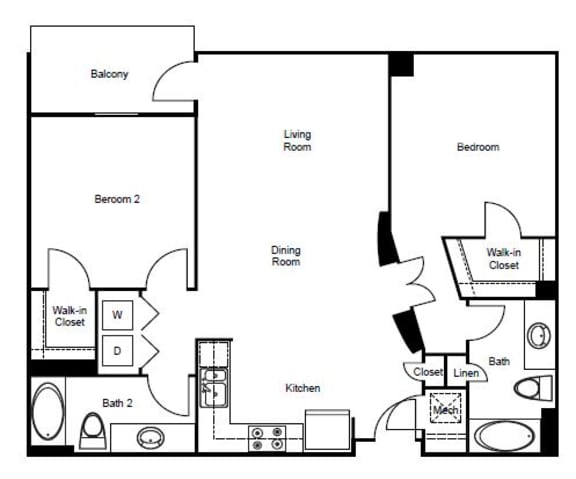
At what (x,y) coordinates should I click in order to perform the action: click on tub. Please return your answer as a coordinate pair (x, y). This screenshot has height=479, width=576. Looking at the image, I should click on (48, 409), (504, 432).